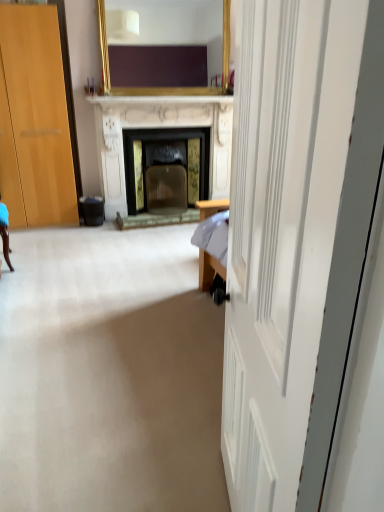
Question: Is white wooden door at center wider or thinner than black plastic trash bin at lower left?

Choices:
 (A) thin
 (B) wide

Answer: (B)

Question: Is white wooden door at center taller or shorter than black plastic trash bin at lower left?

Choices:
 (A) short
 (B) tall

Answer: (B)

Question: Which of these objects is positioned farthest from the black plastic trash bin at lower left?

Choices:
 (A) gold-framed mirror at upper center
 (B) white marble fireplace at center
 (C) white wooden door at center

Answer: (C)

Question: Which of these objects is positioned farthest from the black plastic trash bin at lower left?

Choices:
 (A) white marble fireplace at center
 (B) gold-framed mirror at upper center
 (C) white wooden door at center

Answer: (C)